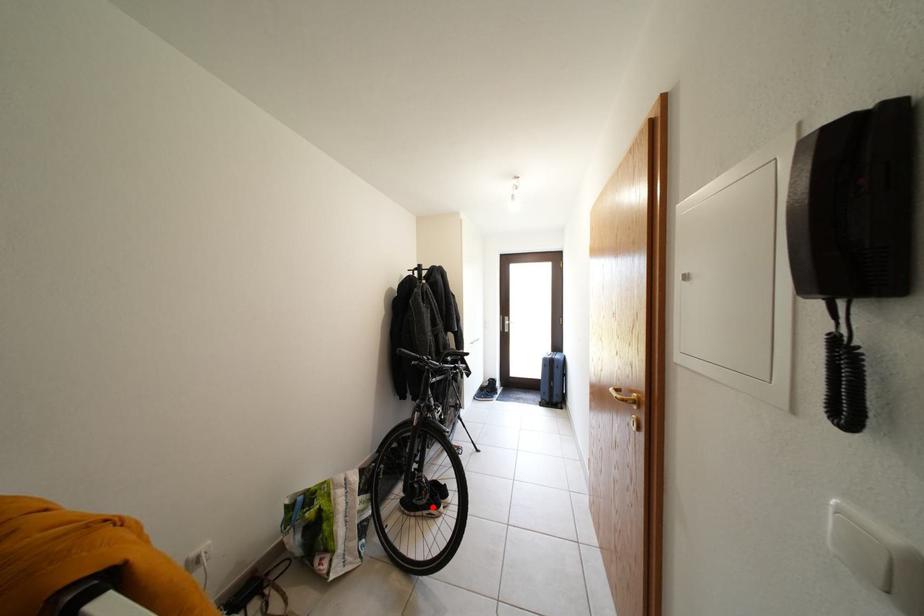
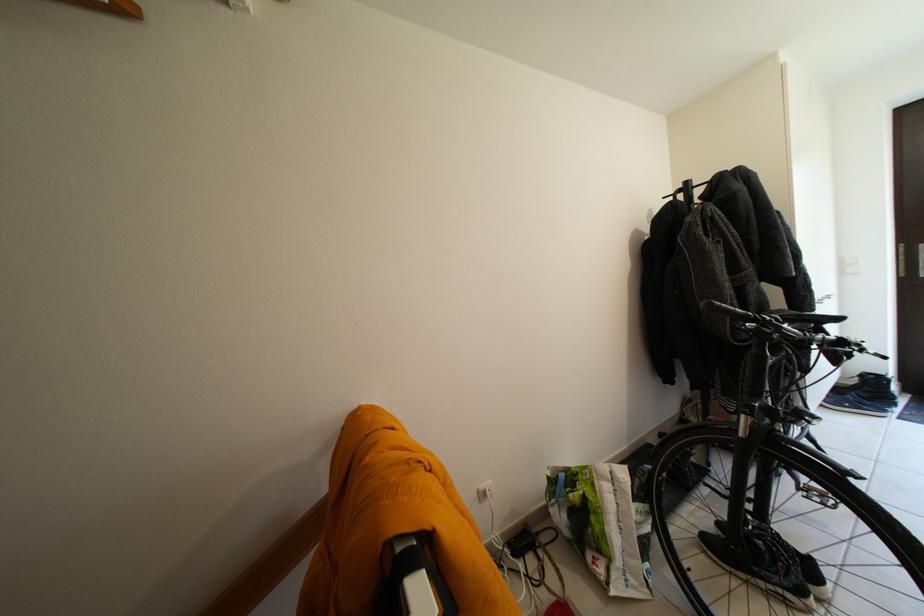
Question: A red point is marked in image1. In image2, is the corresponding 3D point closer to the camera or farther? Reply with the corresponding letter.

Choices:
 (A) The corresponding 3D point is closer.
 (B) The corresponding 3D point is farther.

Answer: (B)